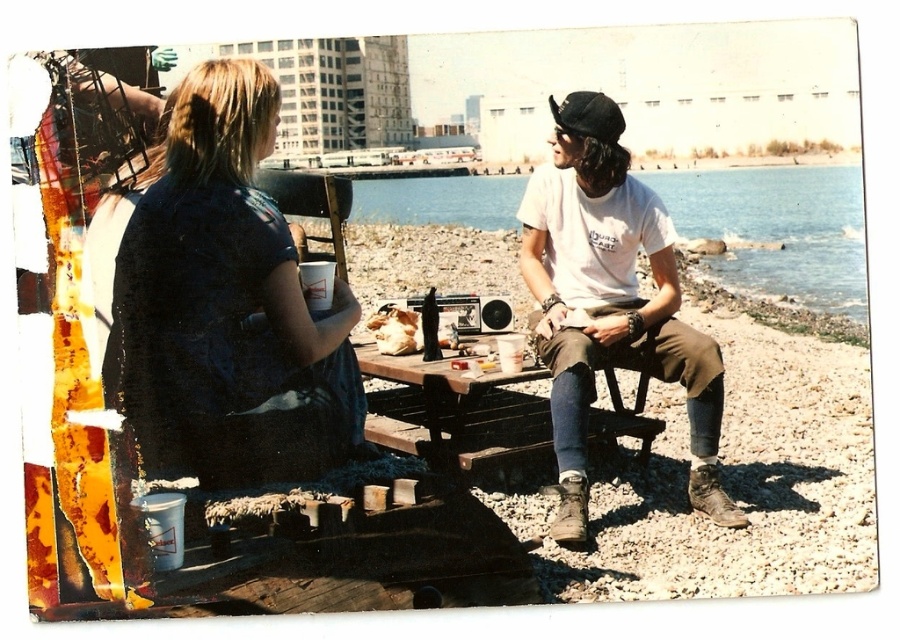
Question: Among these objects, which one is farthest from the camera?

Choices:
 (A) blue water at center
 (B) matte blue shirt at center
 (C) wooden picnic table at center

Answer: (A)

Question: Which object appears farthest from the camera in this image?

Choices:
 (A) wooden picnic table at center
 (B) white cotton t-shirt at center
 (C) blue water at center
 (D) matte blue shirt at center

Answer: (C)

Question: Does matte blue shirt at center lie in front of white cotton t-shirt at center?

Choices:
 (A) yes
 (B) no

Answer: (A)

Question: Which is nearer to the wooden picnic table at center?

Choices:
 (A) blue water at center
 (B) matte blue shirt at center
 (C) white cotton t-shirt at center

Answer: (C)

Question: Can you confirm if matte blue shirt at center is positioned above wooden picnic table at center?

Choices:
 (A) no
 (B) yes

Answer: (B)

Question: Is blue water at center wider than wooden picnic table at center?

Choices:
 (A) yes
 (B) no

Answer: (A)